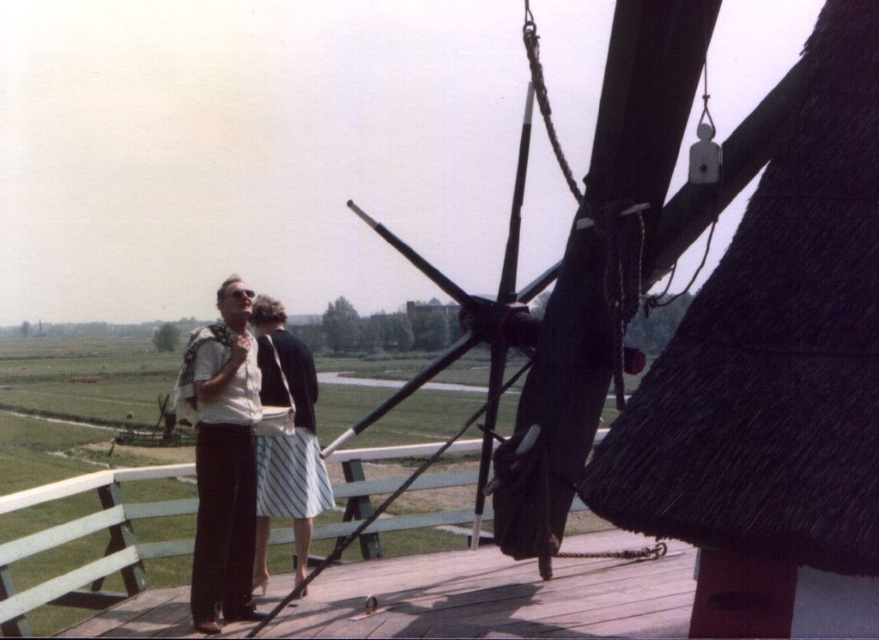
You are standing on the wooden platform of the windmill and see two points marked on the ground. The first point is at coordinates point (572, 541) and the second point is at point (280, 333). Which point is closer to you?

Point (572, 541) is further to the viewer than point (280, 333), so the second point is closer to you.

You are standing on the wooden platform of the windmill and want to move from the point at coordinates point (x=509, y=563) to the point at coordinates point (x=209, y=588). Which direction should you move in to reach your destination?

To move from point (x=509, y=563) to point (x=209, y=588), you should move forward because point (x=509, y=563) is behind point (x=209, y=588).

You are standing on the wooden platform of the windmill. You see the wooden at center and the striped cotton skirt at center. Which object is closer to you?

The wooden at center is closer to you since it is in front of the striped cotton skirt at center.